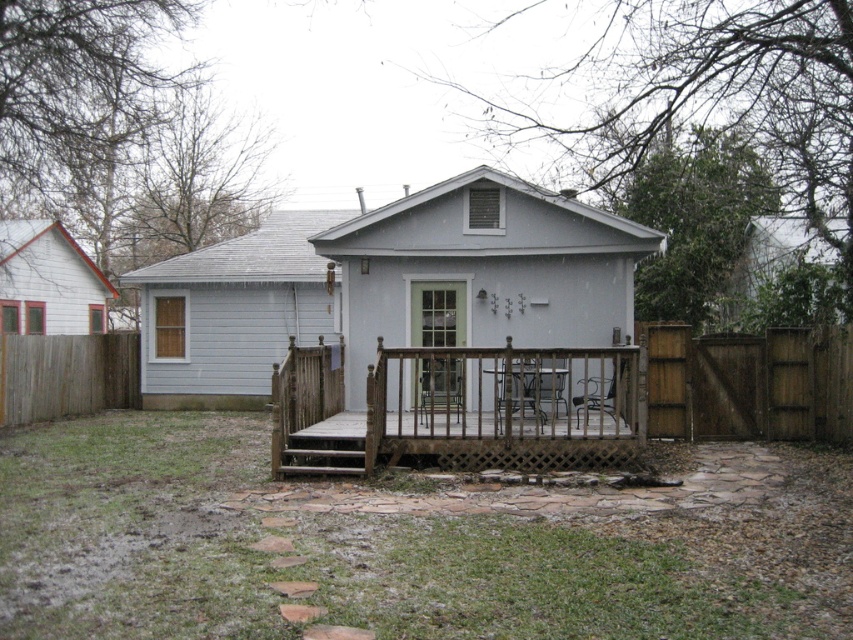
You are a delivery person approaching the house. You see the brown wooden fence at lower left and the green glass screen door at center. Which one is bigger in size?

The brown wooden fence at lower left has a larger size compared to the green glass screen door at center.

You are standing at the edge of the yard and want to walk towards the house. Which object, the green grass at center or the brown wooden fence at lower left, will you encounter first?

The green grass at center will be encountered first because it is closer to the viewer than the brown wooden fence at lower left.

Looking at this image, you are standing at the entrance of the property and want to reach the weathered wood porch at center. According to the coordinates provided, in which direction should you walk to reach it?

The weathered wood porch at center is located at coordinates point (457, 410). Since the porch is at the center of the image, you should walk straight towards it from the entrance.